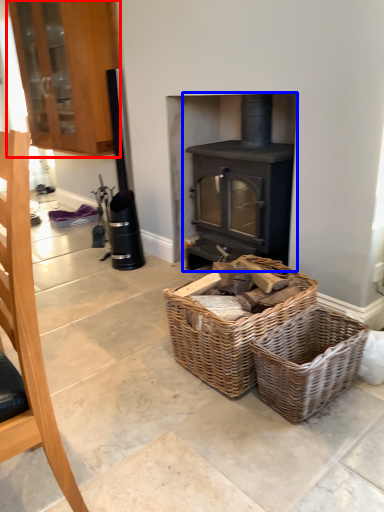
Question: Which of the following is the farthest to the observer, cabinetry (highlighted by a red box) or wood burning stove (highlighted by a blue box)?

Choices:
 (A) cabinetry
 (B) wood burning stove

Answer: (A)